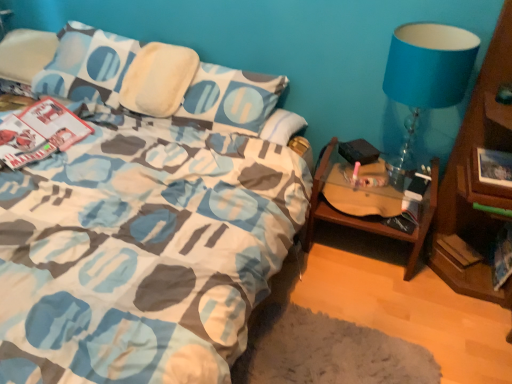
Question: Is hardcover book at lower right thinner than blue fabric lampshade at upper right?

Choices:
 (A) yes
 (B) no

Answer: (A)

Question: From the image's perspective, is hardcover book at lower right under blue fabric lampshade at upper right?

Choices:
 (A) yes
 (B) no

Answer: (A)

Question: Is hardcover book at lower right taller than blue fabric lampshade at upper right?

Choices:
 (A) yes
 (B) no

Answer: (B)

Question: Considering the relative positions of hardcover book at lower right and blue fabric lampshade at upper right in the image provided, is hardcover book at lower right to the left of blue fabric lampshade at upper right from the viewer's perspective?

Choices:
 (A) yes
 (B) no

Answer: (B)

Question: Is hardcover book at lower right closer to camera compared to blue fabric lampshade at upper right?

Choices:
 (A) yes
 (B) no

Answer: (B)

Question: Is blue fabric lampshade at upper right to the left or to the right of woodenobject at right in the image?

Choices:
 (A) right
 (B) left

Answer: (A)

Question: In terms of size, does blue fabric lampshade at upper right appear bigger or smaller than woodenobject at right?

Choices:
 (A) small
 (B) big

Answer: (A)

Question: From the image's perspective, is blue fabric lampshade at upper right above or below woodenobject at right?

Choices:
 (A) below
 (B) above

Answer: (B)

Question: Would you say blue fabric lampshade at upper right is inside or outside woodenobject at right?

Choices:
 (A) outside
 (B) inside

Answer: (A)

Question: Based on their sizes in the image, would you say blue fabric lampshade at upper right is bigger or smaller than hardcover book at lower right?

Choices:
 (A) small
 (B) big

Answer: (B)

Question: From a real-world perspective, is blue fabric lampshade at upper right above or below hardcover book at lower right?

Choices:
 (A) below
 (B) above

Answer: (B)

Question: From the image's perspective, is blue fabric lampshade at upper right positioned above or below hardcover book at lower right?

Choices:
 (A) above
 (B) below

Answer: (A)

Question: Considering the positions of blue fabric lampshade at upper right and hardcover book at lower right in the image, is blue fabric lampshade at upper right taller or shorter than hardcover book at lower right?

Choices:
 (A) tall
 (B) short

Answer: (A)

Question: Looking at the image, does woodenobject at right seem bigger or smaller compared to hardcover book at lower right?

Choices:
 (A) small
 (B) big

Answer: (B)

Question: Considering the relative positions of woodenobject at right and hardcover book at lower right in the image provided, is woodenobject at right to the left or to the right of hardcover book at lower right?

Choices:
 (A) left
 (B) right

Answer: (A)